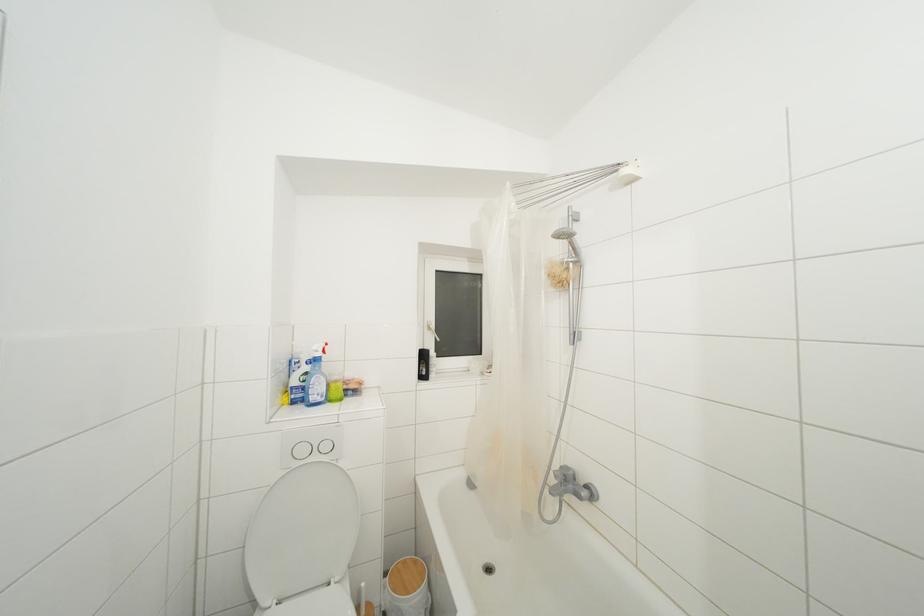
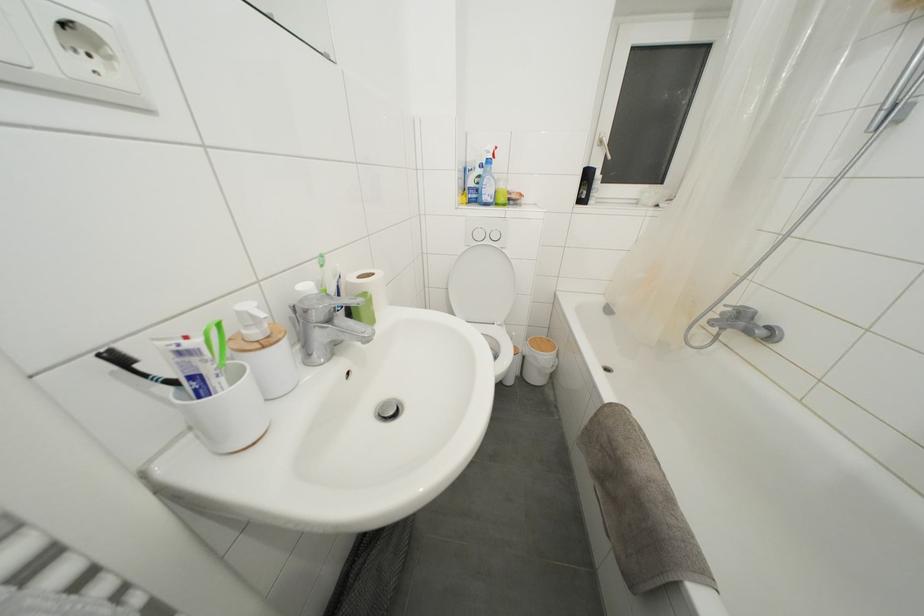
The point at [433,333] is marked in the first image. Where is the corresponding point in the second image?

(604, 148)